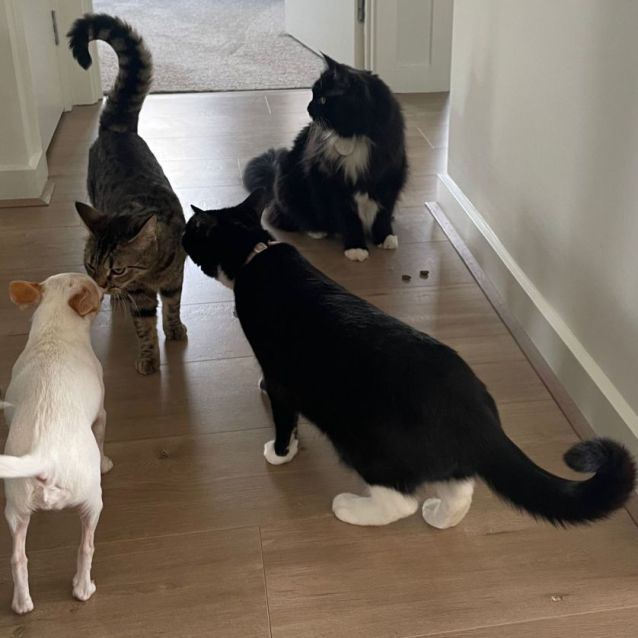
The width and height of the screenshot is (638, 638). Identify the location of carpet. (225, 47).